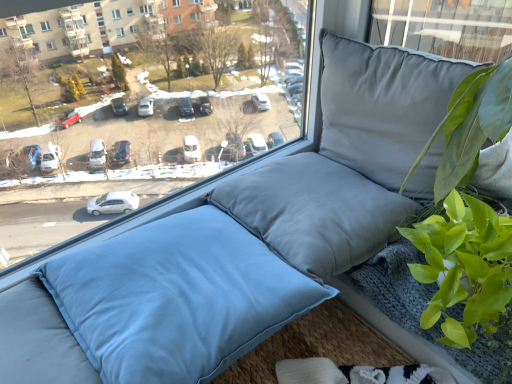
You are a GUI agent. You are given a task and a screenshot of the screen. Output one action in this format:
    pyautogui.click(x=<x>, y=<y>)
    Task: Click on the gray fabric pillow at upper right, arranged as the first pillow when viewed from the top
    The height and width of the screenshot is (384, 512).
    Given the screenshot: What is the action you would take?
    pyautogui.click(x=383, y=104)

This screenshot has height=384, width=512. What are the coordinates of `satin gray pillow at center, which ranks as the 2th pillow in bottom-to-top order` in the screenshot? It's located at (315, 212).

The width and height of the screenshot is (512, 384). Describe the element at coordinates (163, 130) in the screenshot. I see `matte gray cushion at center` at that location.

What is the approximate width of light blue fabric pillow at center, which is the 3th pillow from top to bottom?

light blue fabric pillow at center, which is the 3th pillow from top to bottom, is 19.73 inches wide.

At what (x,y) coordinates should I click in order to perform the action: click on gray fabric pillow at upper right, placed as the third pillow when sorted from bottom to top. Please return your answer as a coordinate pair (x, y). This screenshot has height=384, width=512. Looking at the image, I should click on (383, 104).

Does point (301, 261) come farther from viewer compared to point (383, 122)?

No, (301, 261) is in front of (383, 122).

Between satin gray pillow at center, which ranks as the 2th pillow in bottom-to-top order, and gray fabric pillow at upper right, placed as the third pillow when sorted from bottom to top, which one appears on the right side from the viewer's perspective?

From the viewer's perspective, gray fabric pillow at upper right, placed as the third pillow when sorted from bottom to top, appears more on the right side.

Consider the image. Would you consider satin gray pillow at center, which ranks as the 2th pillow in bottom-to-top order, to be distant from gray fabric pillow at upper right, arranged as the first pillow when viewed from the top?

No.

Looking at this image, could gray fabric pillow at upper right, arranged as the first pillow when viewed from the top, be considered to be inside satin gray pillow at center, arranged as the second pillow when viewed from the top?

Actually, gray fabric pillow at upper right, arranged as the first pillow when viewed from the top, is outside satin gray pillow at center, arranged as the second pillow when viewed from the top.

Measure the distance between satin gray pillow at center, arranged as the second pillow when viewed from the top, and light blue fabric pillow at center, the 1th pillow ordered from the bottom.

satin gray pillow at center, arranged as the second pillow when viewed from the top, and light blue fabric pillow at center, the 1th pillow ordered from the bottom, are 8.25 inches apart.

From their relative heights in the image, would you say satin gray pillow at center, arranged as the second pillow when viewed from the top, is taller or shorter than light blue fabric pillow at center, which is the 3th pillow from top to bottom?

In the image, satin gray pillow at center, arranged as the second pillow when viewed from the top, appears to be shorter than light blue fabric pillow at center, which is the 3th pillow from top to bottom.

Between satin gray pillow at center, which ranks as the 2th pillow in bottom-to-top order, and light blue fabric pillow at center, the 1th pillow ordered from the bottom, which one has larger width?

light blue fabric pillow at center, the 1th pillow ordered from the bottom, is wider.

Can you see satin gray pillow at center, arranged as the second pillow when viewed from the top, touching light blue fabric pillow at center, which is the 3th pillow from top to bottom?

satin gray pillow at center, arranged as the second pillow when viewed from the top, and light blue fabric pillow at center, which is the 3th pillow from top to bottom, are not in contact.

Which is farther, (212, 217) or (400, 227)?

Point (212, 217)

From their relative heights in the image, would you say light blue fabric pillow at center, the 1th pillow ordered from the bottom, is taller or shorter than green leafy plant at right?

light blue fabric pillow at center, the 1th pillow ordered from the bottom, is shorter than green leafy plant at right.

Consider the image. How different are the orientations of light blue fabric pillow at center, the 1th pillow ordered from the bottom, and green leafy plant at right in degrees?

85.3 degrees separate the facing orientations of light blue fabric pillow at center, the 1th pillow ordered from the bottom, and green leafy plant at right.

From the image's perspective, which one is positioned higher, light blue fabric pillow at center, which is the 3th pillow from top to bottom, or green leafy plant at right?

green leafy plant at right appears higher in the image.

The height and width of the screenshot is (384, 512). What are the coordinates of `vegetation above the satin gray pillow at center, which ranks as the 2th pillow in bottom-to-top order (from a real-world perspective)` in the screenshot? It's located at (464, 266).

From the image's perspective, relative to green leafy plant at right, is satin gray pillow at center, arranged as the second pillow when viewed from the top, above or below?

satin gray pillow at center, arranged as the second pillow when viewed from the top, is situated higher than green leafy plant at right in the image.

Is satin gray pillow at center, arranged as the second pillow when viewed from the top, not within green leafy plant at right?

Absolutely, satin gray pillow at center, arranged as the second pillow when viewed from the top, is external to green leafy plant at right.

Consider the image. Is satin gray pillow at center, arranged as the second pillow when viewed from the top, wider or thinner than green leafy plant at right?

Considering their sizes, satin gray pillow at center, arranged as the second pillow when viewed from the top, looks broader than green leafy plant at right.

Is matte gray cushion at center in front of or behind gray fabric pillow at upper right, placed as the third pillow when sorted from bottom to top, in the image?

Clearly, matte gray cushion at center is in front of gray fabric pillow at upper right, placed as the third pillow when sorted from bottom to top.

From the picture: Would you say matte gray cushion at center is to the left or to the right of gray fabric pillow at upper right, arranged as the first pillow when viewed from the top, in the picture?

Based on their positions, matte gray cushion at center is located to the left of gray fabric pillow at upper right, arranged as the first pillow when viewed from the top.

Are matte gray cushion at center and gray fabric pillow at upper right, arranged as the first pillow when viewed from the top, located far from each other?

They are positioned close to each other.

Based on the photo, measure the distance between matte gray cushion at center and gray fabric pillow at upper right, placed as the third pillow when sorted from bottom to top.

A distance of 41.04 centimeters exists between matte gray cushion at center and gray fabric pillow at upper right, placed as the third pillow when sorted from bottom to top.

Are gray fabric pillow at upper right, arranged as the first pillow when viewed from the top, and matte gray cushion at center far apart?

No, there isn't a large distance between gray fabric pillow at upper right, arranged as the first pillow when viewed from the top, and matte gray cushion at center.

How different are the orientations of gray fabric pillow at upper right, arranged as the first pillow when viewed from the top, and matte gray cushion at center in degrees?

The angle between the facing direction of gray fabric pillow at upper right, arranged as the first pillow when viewed from the top, and the facing direction of matte gray cushion at center is 86.1 degrees.

Is gray fabric pillow at upper right, arranged as the first pillow when viewed from the top, to the left of matte gray cushion at center from the viewer's perspective?

No, gray fabric pillow at upper right, arranged as the first pillow when viewed from the top, is not to the left of matte gray cushion at center.

Which object is closer to the camera, light blue fabric pillow at center, which is the 3th pillow from top to bottom, or gray fabric pillow at upper right, arranged as the first pillow when viewed from the top?

light blue fabric pillow at center, which is the 3th pillow from top to bottom, is closer to the camera.

From a real-world perspective, count 2nd pillows upward from the light blue fabric pillow at center, which is the 3th pillow from top to bottom, and point to it. Please provide its 2D coordinates.

[(383, 104)]

From their relative heights in the image, would you say light blue fabric pillow at center, the 1th pillow ordered from the bottom, is taller or shorter than gray fabric pillow at upper right, placed as the third pillow when sorted from bottom to top?

Considering their sizes, light blue fabric pillow at center, the 1th pillow ordered from the bottom, has less height than gray fabric pillow at upper right, placed as the third pillow when sorted from bottom to top.

Visually, is light blue fabric pillow at center, the 1th pillow ordered from the bottom, positioned to the left or to the right of gray fabric pillow at upper right, placed as the third pillow when sorted from bottom to top?

From the image, it's evident that light blue fabric pillow at center, the 1th pillow ordered from the bottom, is to the left of gray fabric pillow at upper right, placed as the third pillow when sorted from bottom to top.

Image resolution: width=512 pixels, height=384 pixels. In order to click on pillow behind the satin gray pillow at center, arranged as the second pillow when viewed from the top in this screenshot , I will do `click(383, 104)`.

From the image's perspective, starting from the light blue fabric pillow at center, the 1th pillow ordered from the bottom, which pillow is the 1st one above? Please provide its 2D coordinates.

[(315, 212)]

Looking at the image, which one is located closer to light blue fabric pillow at center, the 1th pillow ordered from the bottom, gray fabric pillow at upper right, arranged as the first pillow when viewed from the top, or satin gray pillow at center, which ranks as the 2th pillow in bottom-to-top order?

Based on the image, satin gray pillow at center, which ranks as the 2th pillow in bottom-to-top order, appears to be nearer to light blue fabric pillow at center, the 1th pillow ordered from the bottom.

From the image, which object appears to be nearer to light blue fabric pillow at center, which is the 3th pillow from top to bottom, matte gray cushion at center or green leafy plant at right?

matte gray cushion at center lies closer to light blue fabric pillow at center, which is the 3th pillow from top to bottom, than the other object.

Estimate the real-world distances between objects in this image. Which object is further from satin gray pillow at center, arranged as the second pillow when viewed from the top, matte gray cushion at center or light blue fabric pillow at center, the 1th pillow ordered from the bottom?

matte gray cushion at center.

Which object lies nearer to the anchor point green leafy plant at right, satin gray pillow at center, arranged as the second pillow when viewed from the top, or gray fabric pillow at upper right, arranged as the first pillow when viewed from the top?

satin gray pillow at center, arranged as the second pillow when viewed from the top, lies closer to green leafy plant at right than the other object.

Based on their spatial positions, is matte gray cushion at center or gray fabric pillow at upper right, arranged as the first pillow when viewed from the top, further from light blue fabric pillow at center, which is the 3th pillow from top to bottom?

gray fabric pillow at upper right, arranged as the first pillow when viewed from the top, lies further to light blue fabric pillow at center, which is the 3th pillow from top to bottom, than the other object.

Considering their positions, is satin gray pillow at center, arranged as the second pillow when viewed from the top, positioned further to gray fabric pillow at upper right, placed as the third pillow when sorted from bottom to top, than green leafy plant at right?

Among the two, green leafy plant at right is located further to gray fabric pillow at upper right, placed as the third pillow when sorted from bottom to top.

Estimate the real-world distances between objects in this image. Which object is closer to satin gray pillow at center, which ranks as the 2th pillow in bottom-to-top order, gray fabric pillow at upper right, placed as the third pillow when sorted from bottom to top, or light blue fabric pillow at center, the 1th pillow ordered from the bottom?

gray fabric pillow at upper right, placed as the third pillow when sorted from bottom to top, is positioned closer to the anchor satin gray pillow at center, which ranks as the 2th pillow in bottom-to-top order.

In the scene shown: From the image, which object appears to be nearer to green leafy plant at right, satin gray pillow at center, arranged as the second pillow when viewed from the top, or matte gray cushion at center?

The object closer to green leafy plant at right is satin gray pillow at center, arranged as the second pillow when viewed from the top.

The height and width of the screenshot is (384, 512). Find the location of `window between light blue fabric pillow at center, the 1th pillow ordered from the bottom, and green leafy plant at right`. window between light blue fabric pillow at center, the 1th pillow ordered from the bottom, and green leafy plant at right is located at coordinates [163, 130].

The image size is (512, 384). Identify the location of pillow between light blue fabric pillow at center, which is the 3th pillow from top to bottom, and gray fabric pillow at upper right, arranged as the first pillow when viewed from the top. (315, 212).

I want to click on pillow between matte gray cushion at center and gray fabric pillow at upper right, arranged as the first pillow when viewed from the top, so click(x=315, y=212).

You are a GUI agent. You are given a task and a screenshot of the screen. Output one action in this format:
    pyautogui.click(x=<x>, y=<y>)
    Task: Click on the window located between light blue fabric pillow at center, which is the 3th pillow from top to bottom, and gray fabric pillow at upper right, arranged as the first pillow when viewed from the top, in the left-right direction
    The image size is (512, 384).
    Given the screenshot: What is the action you would take?
    pyautogui.click(x=163, y=130)